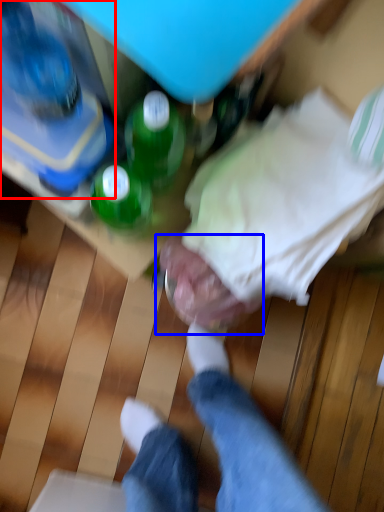
Question: Which object appears closest to the camera in this image, bottle (highlighted by a red box) or head (highlighted by a blue box)?

Choices:
 (A) bottle
 (B) head

Answer: (A)